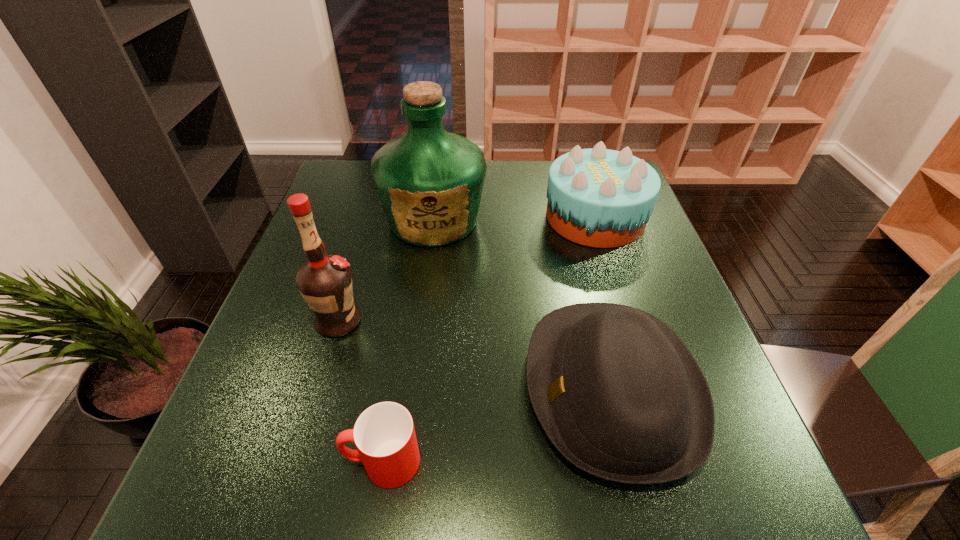
Locate an element on the screen. fedora that is at the right edge is located at coordinates (618, 393).

The image size is (960, 540). Find the location of `object that is at the far right corner`. object that is at the far right corner is located at coordinates (601, 198).

Find the location of a particular element. Image resolution: width=960 pixels, height=540 pixels. object that is at the near right corner is located at coordinates (618, 393).

Find the location of `free point at the far edge`. free point at the far edge is located at coordinates (491, 192).

Find the location of a particular element. vacant space at the left edge of the desktop is located at coordinates (251, 441).

Find the location of a particular element. The image size is (960, 540). vacant space at the right edge of the desktop is located at coordinates (656, 310).

This screenshot has height=540, width=960. Identify the location of free space at the near left corner of the desktop. (291, 484).

Identify the location of vacant area at the near right corner. (751, 481).

Where is `vacant space in between the fedora and the farther liquor`? Image resolution: width=960 pixels, height=540 pixels. vacant space in between the fedora and the farther liquor is located at coordinates (523, 303).

At what (x,y) coordinates should I click in order to perform the action: click on free spot between the farther liquor and the nearer liquor. Please return your answer as a coordinate pair (x, y). This screenshot has width=960, height=540. Looking at the image, I should click on (386, 271).